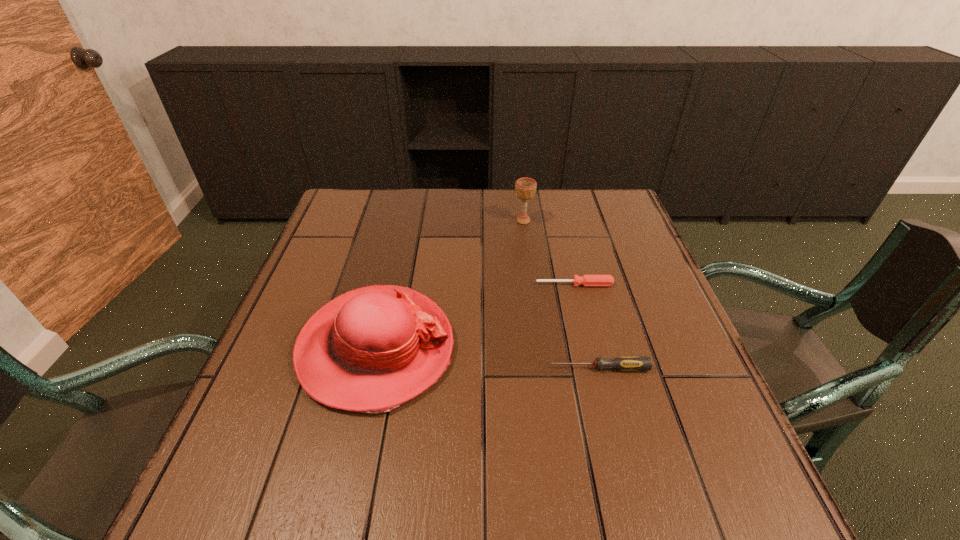
Find the location of a particular element. hat is located at coordinates (372, 349).

Where is `the farthest object`? Image resolution: width=960 pixels, height=540 pixels. the farthest object is located at coordinates (525, 188).

Find the location of a particular element. The image size is (960, 540). the nearer screwdriver is located at coordinates (623, 363).

What are the coordinates of `the third nearest object` in the screenshot? It's located at (586, 280).

Locate an element on the screen. Image resolution: width=960 pixels, height=540 pixels. free location located at the front of the hat with a bow is located at coordinates (512, 348).

At what (x,y) coordinates should I click in order to perform the action: click on vacant point located on the front of the chalice. Please return your answer as a coordinate pair (x, y). The height and width of the screenshot is (540, 960). Looking at the image, I should click on (534, 303).

This screenshot has width=960, height=540. What are the coordinates of `vacant area located 0.090m insert the nearer screwdriver into a screw head` in the screenshot? It's located at (505, 368).

Locate an element on the screen. blank area located 0.360m insert the nearer screwdriver into a screw head is located at coordinates (371, 368).

You are a GUI agent. You are given a task and a screenshot of the screen. Output one action in this format:
    pyautogui.click(x=<x>, y=<y>)
    Task: Click on the vacant region located insert the nearer screwdriver into a screw head
    Image resolution: width=960 pixels, height=540 pixels.
    Given the screenshot: What is the action you would take?
    pyautogui.click(x=355, y=368)

Identify the location of vacant space positioned 0.260m on the left of the farther screwdriver. (429, 285).